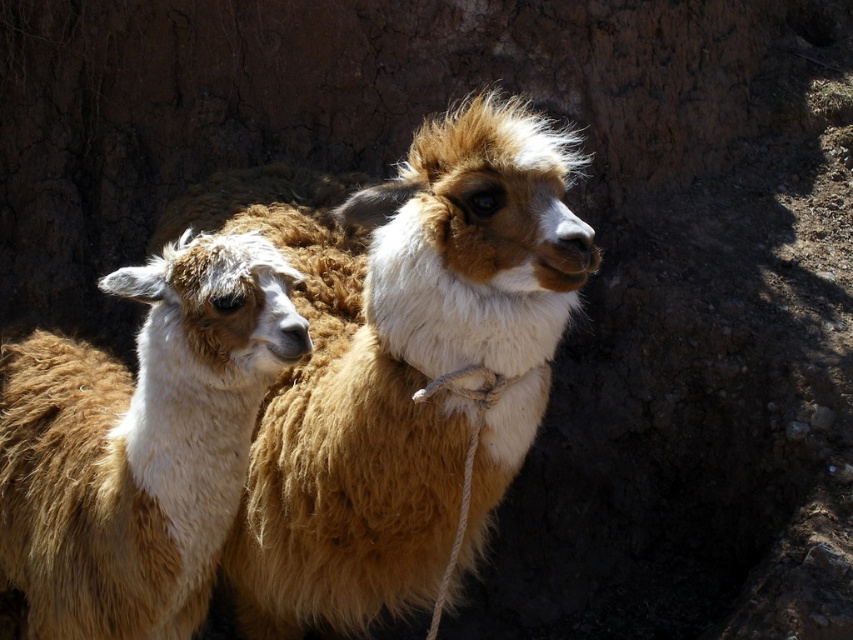
Question: Can you confirm if fuzzy brown alpaca at center is thinner than brown woolen alpaca at left?

Choices:
 (A) no
 (B) yes

Answer: (A)

Question: Considering the relative positions of fuzzy brown alpaca at center and brown woolen alpaca at left in the image provided, where is fuzzy brown alpaca at center located with respect to brown woolen alpaca at left?

Choices:
 (A) below
 (B) above

Answer: (A)

Question: Does fuzzy brown alpaca at center lie in front of brown woolen alpaca at left?

Choices:
 (A) no
 (B) yes

Answer: (A)

Question: Among these objects, which one is nearest to the camera?

Choices:
 (A) fuzzy brown alpaca at center
 (B) brown woolen alpaca at left

Answer: (B)

Question: Which point is farther from the camera taking this photo?

Choices:
 (A) (263, 333)
 (B) (381, 248)

Answer: (B)